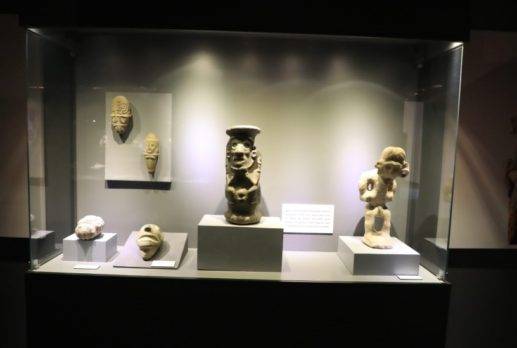
You are a GUI agent. You are given a task and a screenshot of the screen. Output one action in this format:
    pyautogui.click(x=<x>, y=<y>)
    Task: Click on the objects attached to wall
    
    Given the screenshot: What is the action you would take?
    pyautogui.click(x=121, y=111), pyautogui.click(x=152, y=153), pyautogui.click(x=158, y=109), pyautogui.click(x=309, y=214)